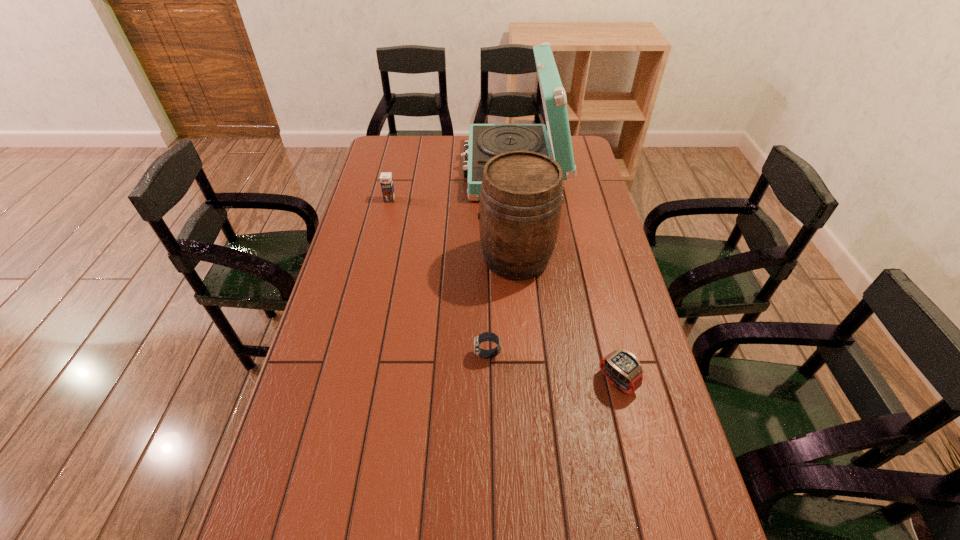
Find the location of a particular element. The height and width of the screenshot is (540, 960). object positioned at the far edge is located at coordinates (486, 141).

Where is `object present at the left edge`? The width and height of the screenshot is (960, 540). object present at the left edge is located at coordinates (386, 181).

I want to click on record player present at the right edge, so click(x=486, y=141).

This screenshot has width=960, height=540. In order to click on watch that is at the right edge in this screenshot , I will do `click(621, 367)`.

Identify the location of object that is at the far right corner. This screenshot has width=960, height=540. (486, 141).

The width and height of the screenshot is (960, 540). I want to click on vacant space at the left edge, so click(309, 355).

What are the coordinates of `vacant space at the right edge` in the screenshot? It's located at (584, 184).

The height and width of the screenshot is (540, 960). Find the location of `blank space at the far left corner`. blank space at the far left corner is located at coordinates (386, 151).

Image resolution: width=960 pixels, height=540 pixels. Find the location of `unoccupied area between the nearest object and the cider`. unoccupied area between the nearest object and the cider is located at coordinates (566, 320).

I want to click on blank region between the nearer watch and the second nearest object, so click(552, 368).